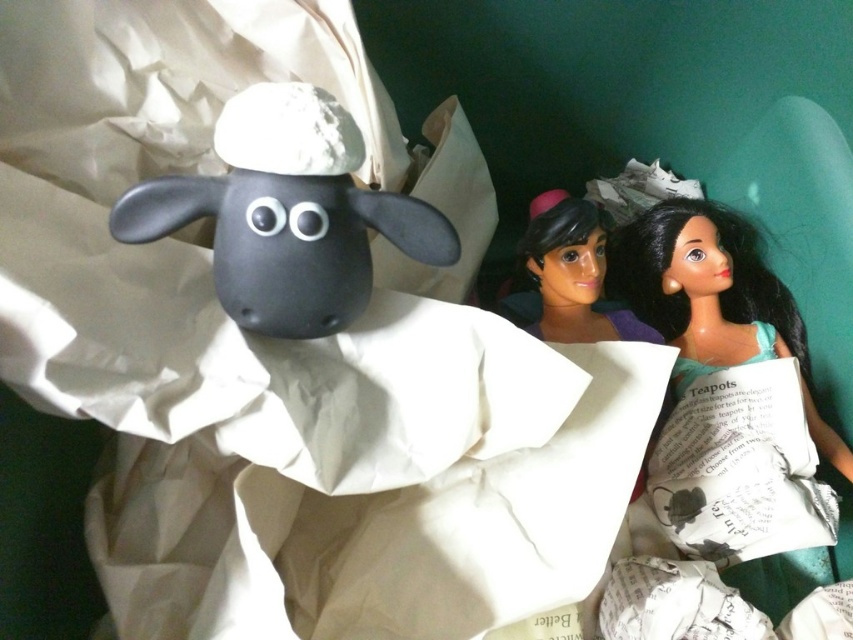
Question: Considering the real-world distances, which object is farthest from the smooth plastic doll at center?

Choices:
 (A) smooth plastic doll at right
 (B) matte black sheep at center

Answer: (B)

Question: Among these objects, which one is farthest from the camera?

Choices:
 (A) smooth plastic doll at right
 (B) matte black sheep at center
 (C) smooth plastic doll at center

Answer: (A)

Question: Which of these objects is positioned farthest from the smooth plastic doll at center?

Choices:
 (A) matte black sheep at center
 (B) smooth plastic doll at right

Answer: (A)

Question: Is matte black sheep at center positioned behind smooth plastic doll at center?

Choices:
 (A) no
 (B) yes

Answer: (A)

Question: Can you confirm if smooth plastic doll at right is positioned to the left of smooth plastic doll at center?

Choices:
 (A) yes
 (B) no

Answer: (B)

Question: Can you confirm if matte black sheep at center is wider than smooth plastic doll at right?

Choices:
 (A) no
 (B) yes

Answer: (B)